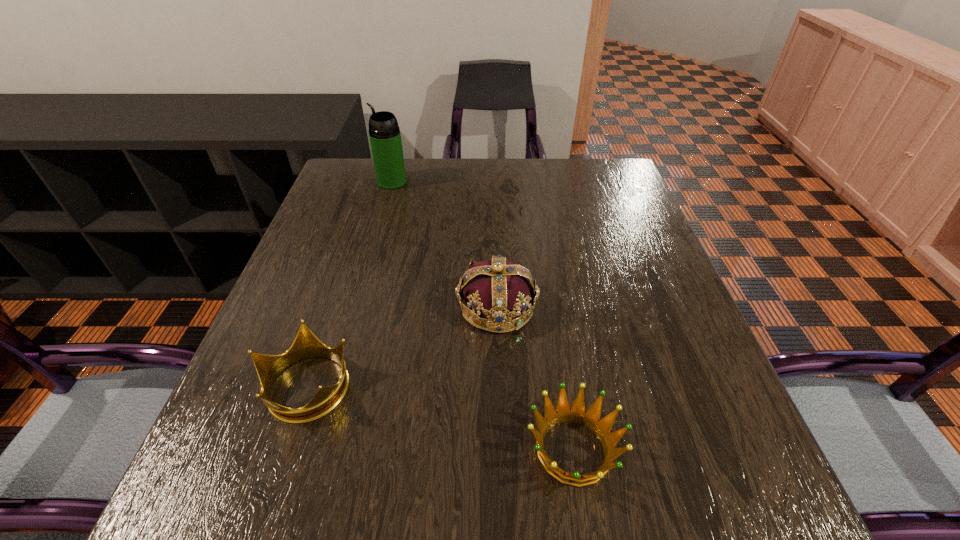
In order to click on empty location between the shortest crown and the second farthest object in this screenshot , I will do `click(535, 378)`.

Locate which object ranks third in proximity to the thermos bottle. Please provide its 2D coordinates. Your answer should be formatted as a tuple, i.e. [(x, y)], where the tuple contains the x and y coordinates of a point satisfying the conditions above.

[(577, 413)]

The image size is (960, 540). Identify the location of object that stands as the third closest to the second shortest object. (384, 133).

Identify which crown is the closest to the shortest crown. Please provide its 2D coordinates. Your answer should be formatted as a tuple, i.e. [(x, y)], where the tuple contains the x and y coordinates of a point satisfying the conditions above.

[(500, 290)]

Image resolution: width=960 pixels, height=540 pixels. What are the coordinates of `crown that stands as the closest to the third tallest object` in the screenshot? It's located at (500, 290).

What are the coordinates of `vacant point that satisfies the following two spatial constraints: 1. from the spout of the tallest object; 2. on the right side of the shortest object` in the screenshot? It's located at (318, 450).

At what (x,y) coordinates should I click in order to perform the action: click on free location that satisfies the following two spatial constraints: 1. on the back side of the shortest crown; 2. from the spout of the thermos bottle. Please return your answer as a coordinate pair (x, y). Looking at the image, I should click on (531, 182).

This screenshot has width=960, height=540. In order to click on vacant space that satisfies the following two spatial constraints: 1. on the back side of the shortest crown; 2. from the spout of the thermos bottle in this screenshot , I will do `click(531, 182)`.

The image size is (960, 540). I want to click on vacant space that satisfies the following two spatial constraints: 1. from the spout of the farthest object; 2. on the right side of the shortest crown, so click(x=318, y=450).

The height and width of the screenshot is (540, 960). I want to click on free space that satisfies the following two spatial constraints: 1. on the back side of the tallest crown; 2. from the spout of the thermos bottle, so click(x=492, y=182).